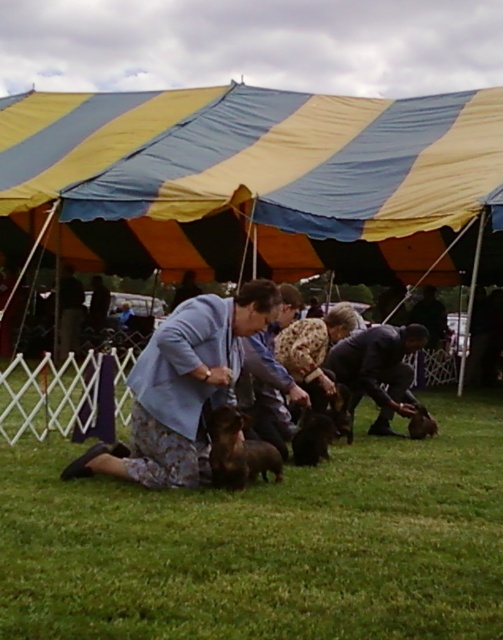
Question: Among these objects, which one is farthest from the camera?

Choices:
 (A) fluffy brown dog at center
 (B) green grass at center

Answer: (A)

Question: Which point is farther to the camera?

Choices:
 (A) (416, 404)
 (B) (471, 122)
 (C) (353, 401)

Answer: (B)

Question: Does yellow striped tent at center appear under brown furry dog at center?

Choices:
 (A) no
 (B) yes

Answer: (A)

Question: Can you confirm if green grass at center is positioned to the right of fluffy brown dog at center?

Choices:
 (A) no
 (B) yes

Answer: (B)

Question: Which of the following is the farthest from the observer?

Choices:
 (A) green grass at center
 (B) yellow striped tent at center
 (C) fluffy brown dog at center
 (D) dark blue shirt at center

Answer: (B)

Question: Is yellow striped tent at center closer to camera compared to dark blue shirt at center?

Choices:
 (A) yes
 (B) no

Answer: (B)